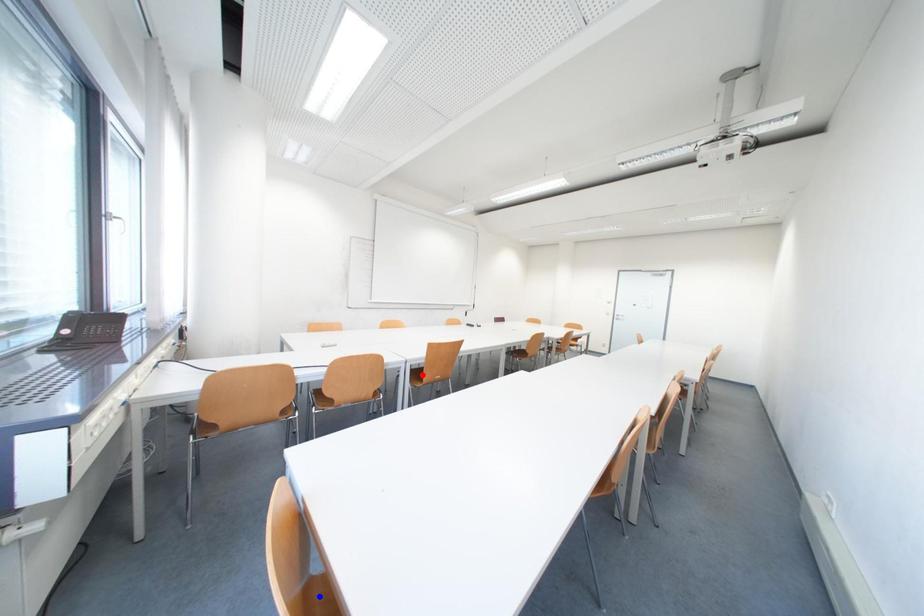
Question: In the image, two points are highlighted. Which point is nearer to the camera? Reply with the corresponding letter.

Choices:
 (A) blue point
 (B) red point

Answer: (A)